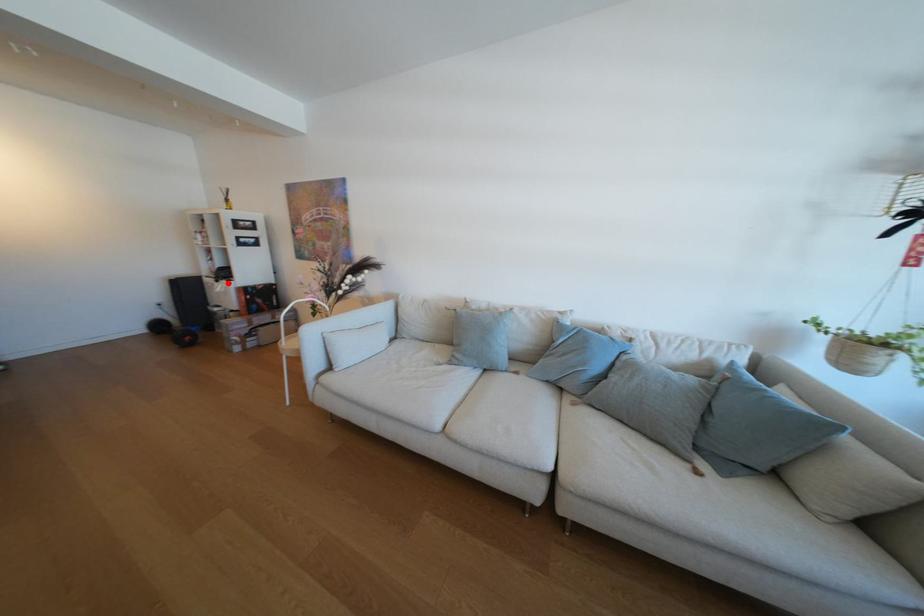
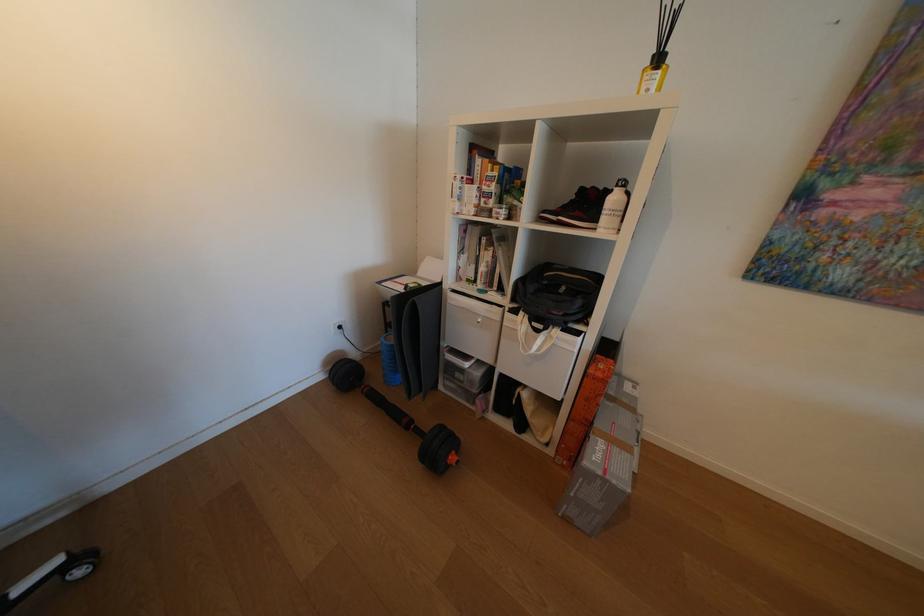
Question: I am providing you with two images of the same scene from different viewpoints. Image1 has a red point marked. In image2, the corresponding 3D location appears at what relative position? Reply with the corresponding letter.

Choices:
 (A) Closer
 (B) Farther

Answer: (B)